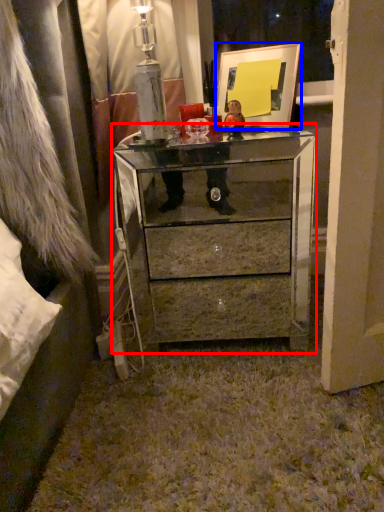
Question: Which object is further to the camera taking this photo, chest of drawers (highlighted by a red box) or picture frame (highlighted by a blue box)?

Choices:
 (A) chest of drawers
 (B) picture frame

Answer: (B)